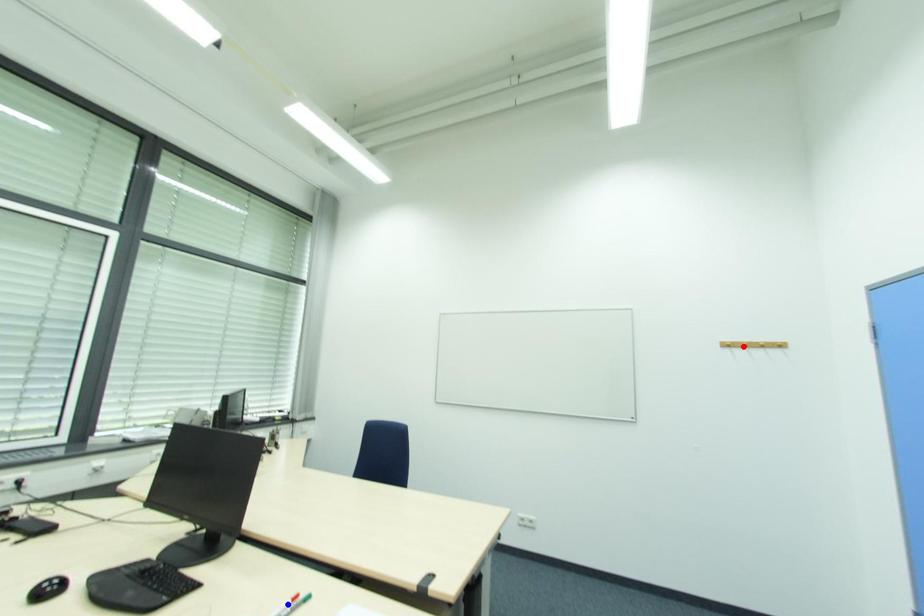
Question: Two points are marked on the image. Which point is closer to the camera?

Choices:
 (A) Blue point is closer.
 (B) Red point is closer.

Answer: (A)